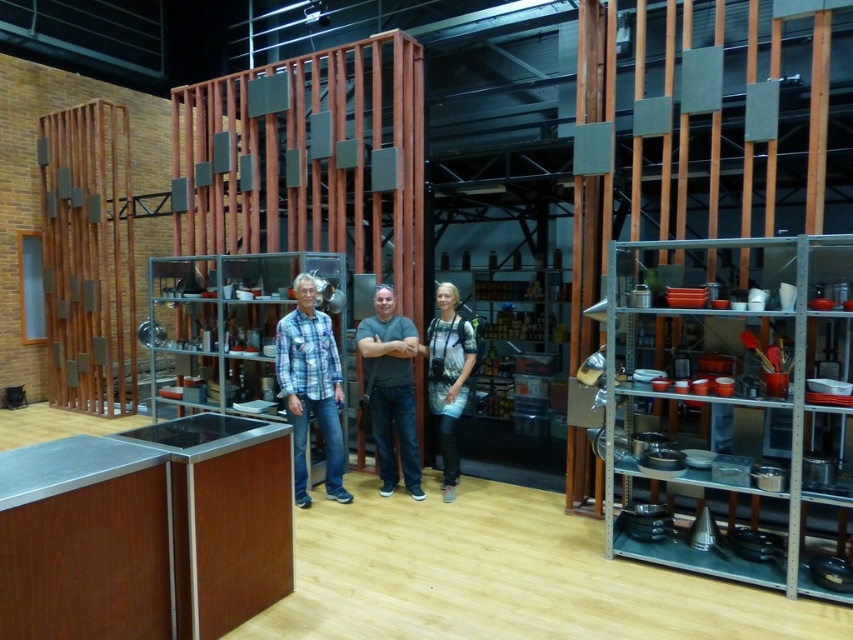
Is plaid cotton shirt at center below denim jacket at center?

Correct, plaid cotton shirt at center is located below denim jacket at center.

Is point (415, 333) closer to viewer compared to point (451, 301)?

No.

Identify the location of plaid cotton shirt at center. (392, 388).

Is blue plaid shirt at center to the right of gray matte shirt at center from the viewer's perspective?

No, blue plaid shirt at center is not to the right of gray matte shirt at center.

Is blue plaid shirt at center thinner than gray matte shirt at center?

No, blue plaid shirt at center is not thinner than gray matte shirt at center.

What do you see at coordinates (311, 387) in the screenshot? This screenshot has height=640, width=853. I see `blue plaid shirt at center` at bounding box center [311, 387].

This screenshot has height=640, width=853. Identify the location of blue plaid shirt at center. click(x=311, y=387).

Does blue plaid shirt at center have a greater width compared to denim jacket at center?

Correct, the width of blue plaid shirt at center exceeds that of denim jacket at center.

Is point (289, 320) farther from viewer compared to point (461, 404)?

No, it is in front of (461, 404).

The width and height of the screenshot is (853, 640). What are the coordinates of `blue plaid shirt at center` in the screenshot? It's located at (311, 387).